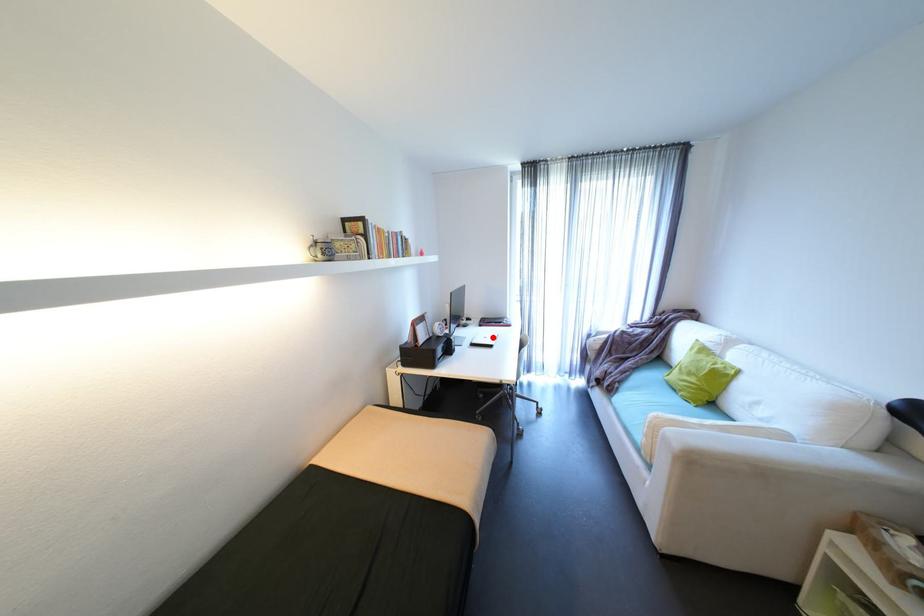
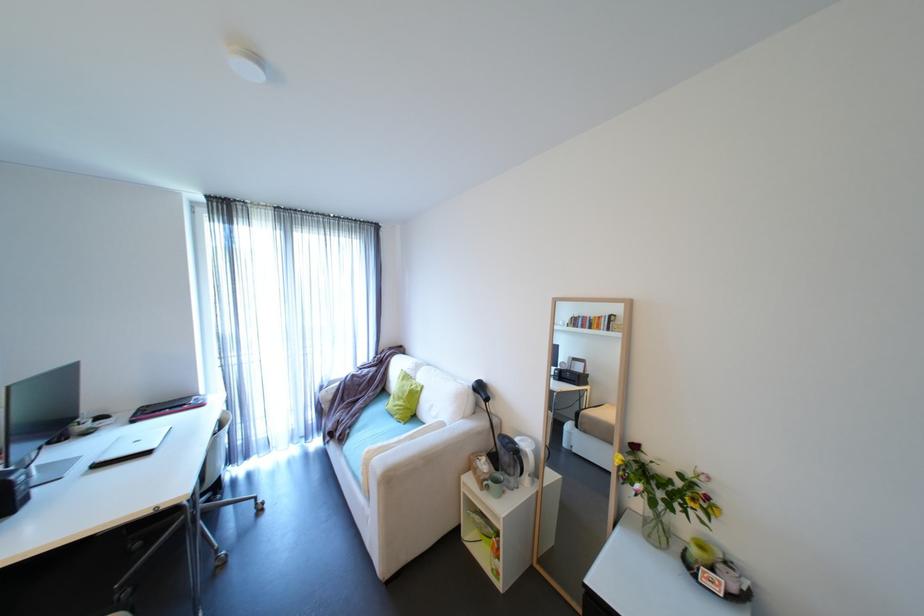
Question: I am providing you with two images of the same scene from different viewpoints. A red point is marked on the first image. Is the red point's position out of view in image 2?

Choices:
 (A) Yes
 (B) No

Answer: (B)